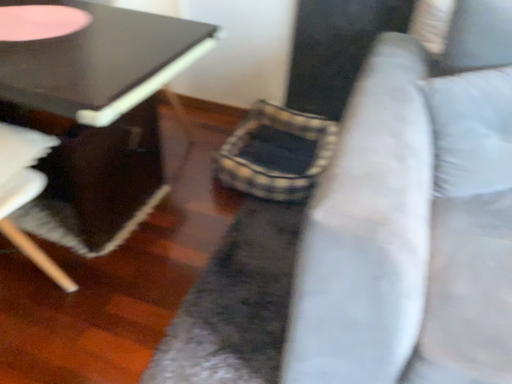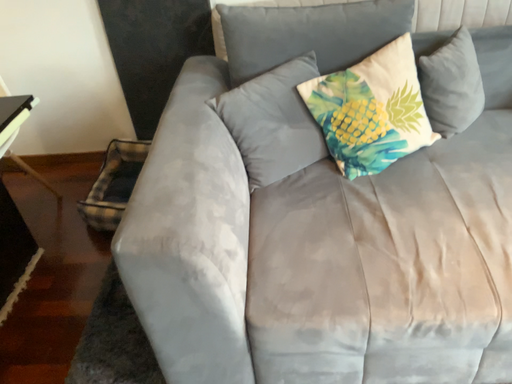
Question: Which way did the camera rotate in the video?

Choices:
 (A) rotated right
 (B) rotated left

Answer: (A)